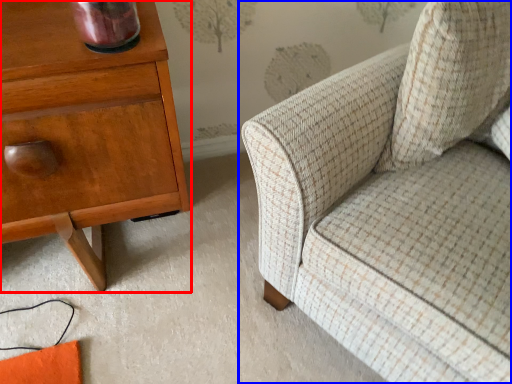
Question: Which object appears farthest to the camera in this image, nightstand (highlighted by a red box) or chair (highlighted by a blue box)?

Choices:
 (A) nightstand
 (B) chair

Answer: (A)